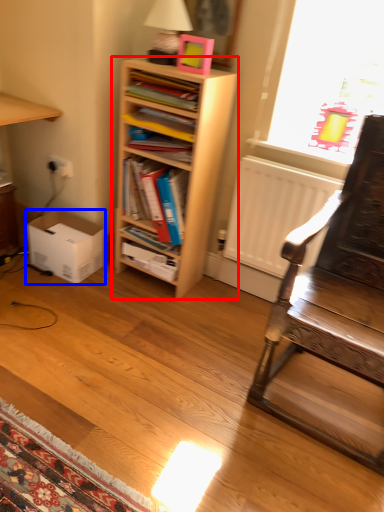
Question: Which object appears farthest to the camera in this image, shelf (highlighted by a red box) or box (highlighted by a blue box)?

Choices:
 (A) shelf
 (B) box

Answer: (B)